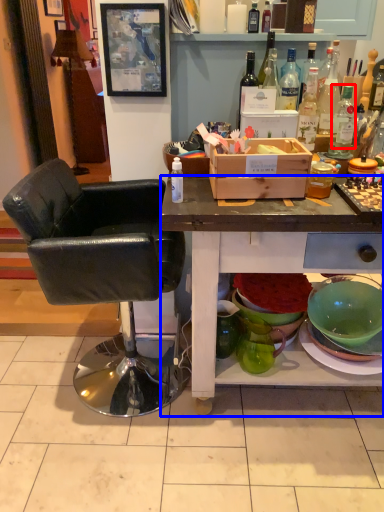
Question: Which object is closer to the camera taking this photo, bottle (highlighted by a red box) or desk (highlighted by a blue box)?

Choices:
 (A) bottle
 (B) desk

Answer: (B)